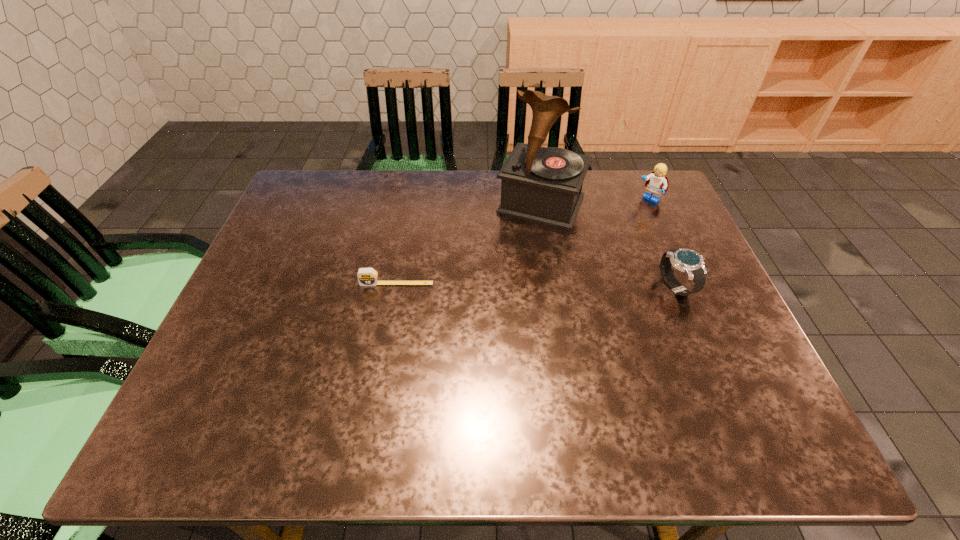
Where is `free space located at the horn opening of the tallest object`? This screenshot has height=540, width=960. free space located at the horn opening of the tallest object is located at coordinates (487, 315).

What are the coordinates of `free point located on the front-facing side of the Lego` in the screenshot? It's located at (609, 234).

At what (x,y) coordinates should I click in order to perform the action: click on vacant space located on the front-facing side of the Lego. Please return your answer as a coordinate pair (x, y). Image resolution: width=960 pixels, height=540 pixels. Looking at the image, I should click on (592, 249).

Locate an element on the screen. The height and width of the screenshot is (540, 960). vacant area located 0.110m on the front-facing side of the Lego is located at coordinates (623, 221).

Locate an element on the screen. The image size is (960, 540). phonograph_record located at the far edge is located at coordinates (543, 185).

Find the location of `Lego present at the far edge`. Lego present at the far edge is located at coordinates (657, 183).

This screenshot has width=960, height=540. Find the location of `watch that is positioned at the right edge`. watch that is positioned at the right edge is located at coordinates (688, 261).

You are a GUI agent. You are given a task and a screenshot of the screen. Output one action in this format:
    pyautogui.click(x=<x>, y=<y>)
    Task: Click on the Lego that is at the right edge
    This screenshot has height=540, width=960.
    Given the screenshot: What is the action you would take?
    tap(657, 183)

The height and width of the screenshot is (540, 960). What are the coordinates of `object positioned at the far right corner` in the screenshot? It's located at (657, 183).

In the image, there is a desktop. At what (x,y) coordinates should I click in order to perform the action: click on vacant space at the far edge. Please return your answer as a coordinate pair (x, y). This screenshot has height=540, width=960. Looking at the image, I should click on (460, 209).